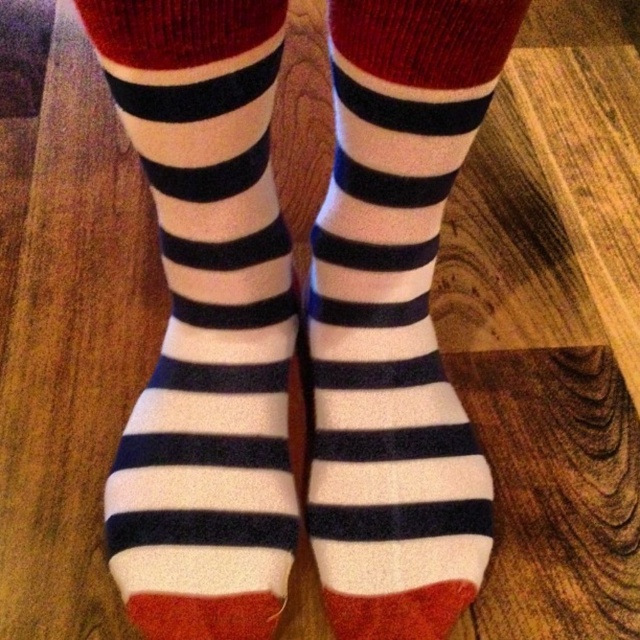
You are a photographer setting up a shot of the socks. You want to focus on the point closer to the camera. Which point should you choose between point (477, 49) and point (179, 198)?

Point (477, 49) is in front of point (179, 198), so you should focus on point (477, 49) to capture the closer one.